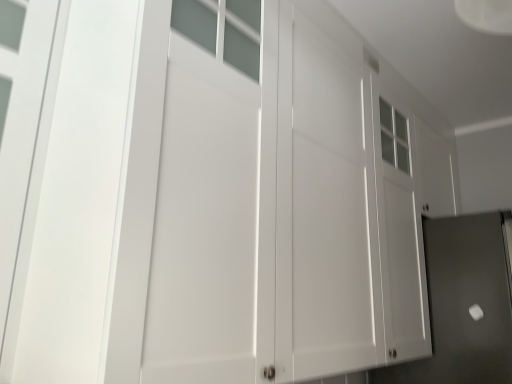
What do you see at coordinates (467, 302) in the screenshot? I see `white glossy screen door at right` at bounding box center [467, 302].

You are a GUI agent. You are given a task and a screenshot of the screen. Output one action in this format:
    pyautogui.click(x=<x>, y=<y>)
    Task: Click on the white glossy screen door at right
    The image size is (512, 384).
    Given the screenshot: What is the action you would take?
    point(467,302)

You are a GUI agent. You are given a task and a screenshot of the screen. Output one action in this format:
    pyautogui.click(x=<x>, y=<y>)
    Task: Click on the white glossy screen door at right
    The image size is (512, 384).
    Given the screenshot: What is the action you would take?
    pyautogui.click(x=467, y=302)